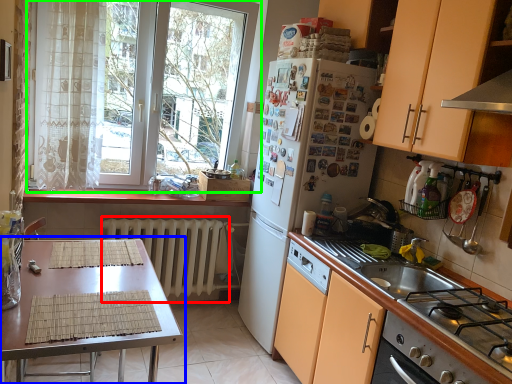
Question: Considering the real-world distances, which object is closest to radiator (highlighted by a red box)? table (highlighted by a blue box) or window (highlighted by a green box).

Choices:
 (A) table
 (B) window

Answer: (B)